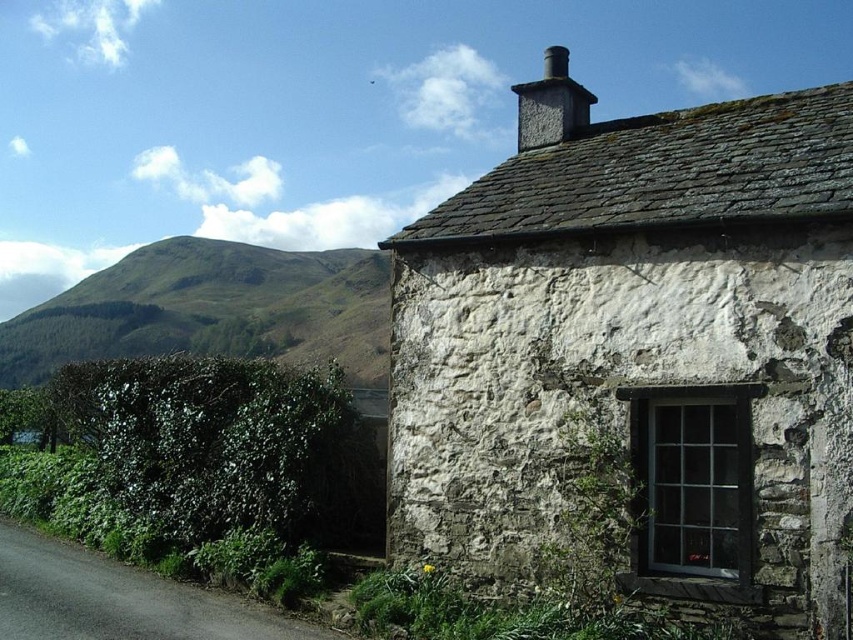
Question: Estimate the real-world distances between objects in this image. Which object is farther from the green grassy hillside at upper left?

Choices:
 (A) green leafy hedge at left
 (B) gray stone chimney at upper center
 (C) white stone cottage at center

Answer: (C)

Question: Which point is closer to the camera taking this photo?

Choices:
 (A) (10, 400)
 (B) (543, 106)
 (C) (608, 284)

Answer: (C)

Question: Is white stone cottage at center smaller than green leafy hedge at left?

Choices:
 (A) yes
 (B) no

Answer: (A)

Question: Does green leafy hedge at left have a smaller size compared to green grassy hillside at upper left?

Choices:
 (A) no
 (B) yes

Answer: (B)

Question: Which of the following is the farthest from the observer?

Choices:
 (A) gray stone chimney at upper center
 (B) green grassy hillside at upper left
 (C) white stone cottage at center

Answer: (B)

Question: From the image, what is the correct spatial relationship of green leafy hedge at left in relation to gray stone chimney at upper center?

Choices:
 (A) left
 (B) right

Answer: (A)